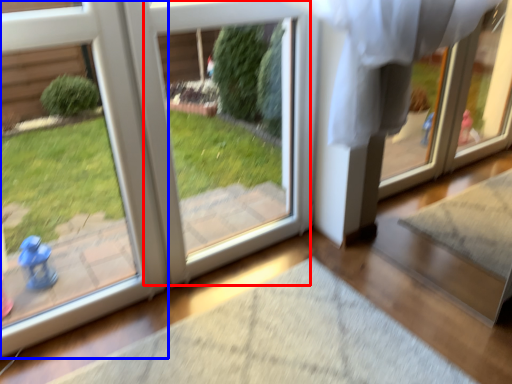
Question: Among these objects, which one is nearest to the camera, screen door (highlighted by a red box) or door (highlighted by a blue box)?

Choices:
 (A) screen door
 (B) door

Answer: (B)